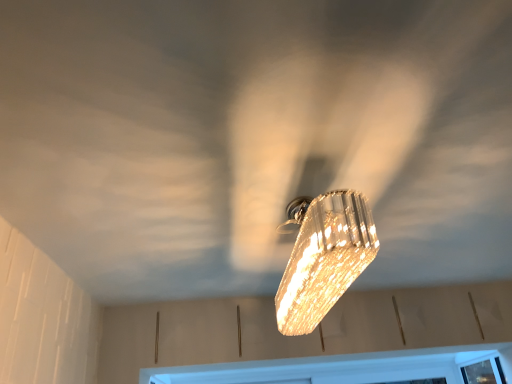
The image size is (512, 384). What do you see at coordinates (324, 257) in the screenshot? I see `clear crystal light fixture at center` at bounding box center [324, 257].

What are the coordinates of `clear crystal light fixture at center` in the screenshot? It's located at (324, 257).

Measure the distance between white plastic window frame at bottom and camera.

white plastic window frame at bottom and camera are 3.20 meters apart.

Image resolution: width=512 pixels, height=384 pixels. Describe the element at coordinates (348, 368) in the screenshot. I see `white plastic window frame at bottom` at that location.

Where is `white plastic window frame at bottom`? white plastic window frame at bottom is located at coordinates (348, 368).

In order to face white plastic window frame at bottom, should I rotate leftwards or rightwards?

To face it directly, rotate right by 10.390 degrees.

You are a GUI agent. You are given a task and a screenshot of the screen. Output one action in this format:
    pyautogui.click(x=<x>, y=<y>)
    Task: Click on the clear crystal light fixture at center
    
    Given the screenshot: What is the action you would take?
    pyautogui.click(x=324, y=257)

Which is more to the right, clear crystal light fixture at center or white plastic window frame at bottom?

Positioned to the right is white plastic window frame at bottom.

Considering their positions, is clear crystal light fixture at center located in front of or behind white plastic window frame at bottom?

clear crystal light fixture at center is in front of white plastic window frame at bottom.

Looking at this image, which point is more distant from viewer, (355, 219) or (366, 359)?

The point (366, 359) is more distant.

From the image's perspective, which is below, clear crystal light fixture at center or white plastic window frame at bottom?

white plastic window frame at bottom, from the image's perspective.

From a real-world perspective, who is located higher, clear crystal light fixture at center or white plastic window frame at bottom?

From a 3D spatial view, clear crystal light fixture at center is above.

Considering the sizes of objects clear crystal light fixture at center and white plastic window frame at bottom in the image provided, who is thinner, clear crystal light fixture at center or white plastic window frame at bottom?

Thinner between the two is clear crystal light fixture at center.

Looking at this image, from their relative heights in the image, would you say clear crystal light fixture at center is taller or shorter than white plastic window frame at bottom?

Considering their sizes, clear crystal light fixture at center has more height than white plastic window frame at bottom.

Between clear crystal light fixture at center and white plastic window frame at bottom, which one has larger size?

clear crystal light fixture at center.

Is white plastic window frame at bottom located within clear crystal light fixture at center?

No, clear crystal light fixture at center does not contain white plastic window frame at bottom.

Would you say clear crystal light fixture at center is a long distance from white plastic window frame at bottom?

Yes, clear crystal light fixture at center is far from white plastic window frame at bottom.

Is clear crystal light fixture at center turned away from white plastic window frame at bottom?

No, clear crystal light fixture at center's orientation is not away from white plastic window frame at bottom.

The image size is (512, 384). I want to click on window frame on the right of clear crystal light fixture at center, so pos(348,368).

Based on their positions, is white plastic window frame at bottom located to the left or right of clear crystal light fixture at center?

In the image, white plastic window frame at bottom appears on the right side of clear crystal light fixture at center.

Which object is more forward, white plastic window frame at bottom or clear crystal light fixture at center?

clear crystal light fixture at center is closer to the camera.

Does point (301, 373) appear closer or farther from the camera than point (319, 224)?

Point (301, 373) is positioned farther from the camera compared to point (319, 224).

From the image's perspective, which one is positioned higher, white plastic window frame at bottom or clear crystal light fixture at center?

clear crystal light fixture at center is shown above in the image.

From a real-world perspective, who is located lower, white plastic window frame at bottom or clear crystal light fixture at center?

white plastic window frame at bottom is physically lower.

Which of these two, white plastic window frame at bottom or clear crystal light fixture at center, is thinner?

clear crystal light fixture at center.

Does white plastic window frame at bottom have a greater height compared to clear crystal light fixture at center?

No.

Is white plastic window frame at bottom bigger than clear crystal light fixture at center?

No.

Is white plastic window frame at bottom not within clear crystal light fixture at center?

white plastic window frame at bottom lies outside clear crystal light fixture at center's area.

Is white plastic window frame at bottom directly adjacent to clear crystal light fixture at center?

No, white plastic window frame at bottom is not beside clear crystal light fixture at center.

Could you tell me if white plastic window frame at bottom is turned towards clear crystal light fixture at center?

No, white plastic window frame at bottom is not turned towards clear crystal light fixture at center.

Can you tell me how much white plastic window frame at bottom and clear crystal light fixture at center differ in facing direction?

A: They differ by 91.6 degrees in their facing directions.

I want to click on lamp located above the white plastic window frame at bottom (from the image's perspective), so click(324, 257).

You are a GUI agent. You are given a task and a screenshot of the screen. Output one action in this format:
    pyautogui.click(x=<x>, y=<y>)
    Task: Click on the lamp that appears in front of the white plastic window frame at bottom
    The height and width of the screenshot is (384, 512).
    Given the screenshot: What is the action you would take?
    pyautogui.click(x=324, y=257)

Identify the location of lamp that is on the left side of white plastic window frame at bottom. (324, 257).